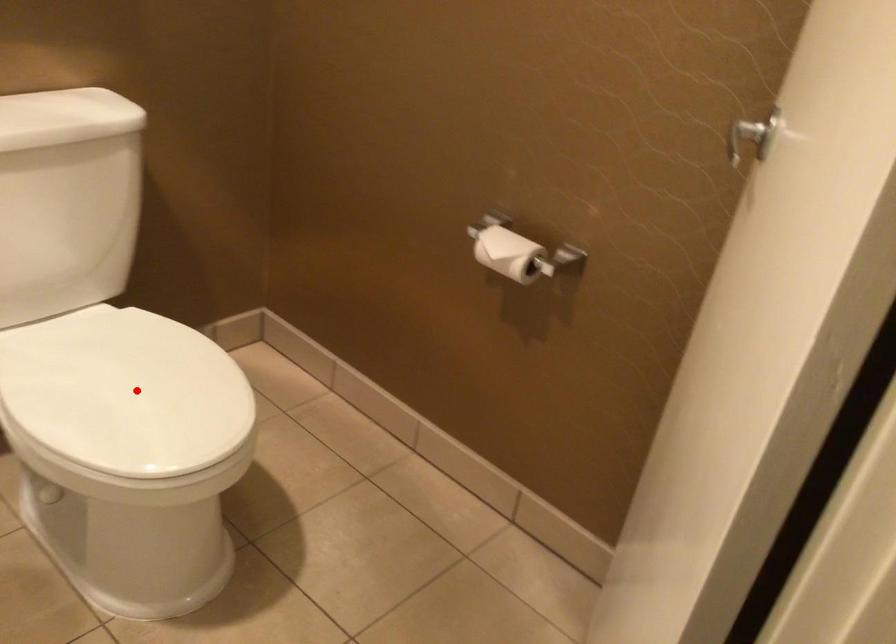
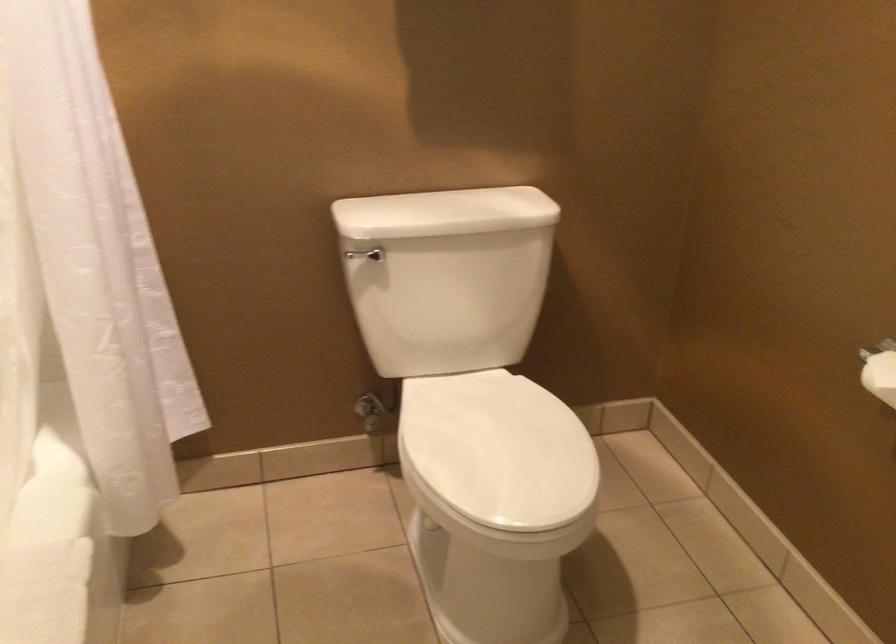
Question: I am providing you with two images of the same scene from different viewpoints. A red point is marked on the first image. Can you still see the location of the red point in image 2?

Choices:
 (A) Yes
 (B) No

Answer: (A)